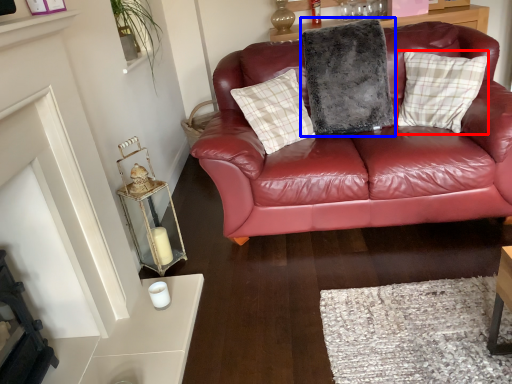
Question: Which of the following is the closest to the observer, pillow (highlighted by a red box) or pillow (highlighted by a blue box)?

Choices:
 (A) pillow
 (B) pillow

Answer: (A)